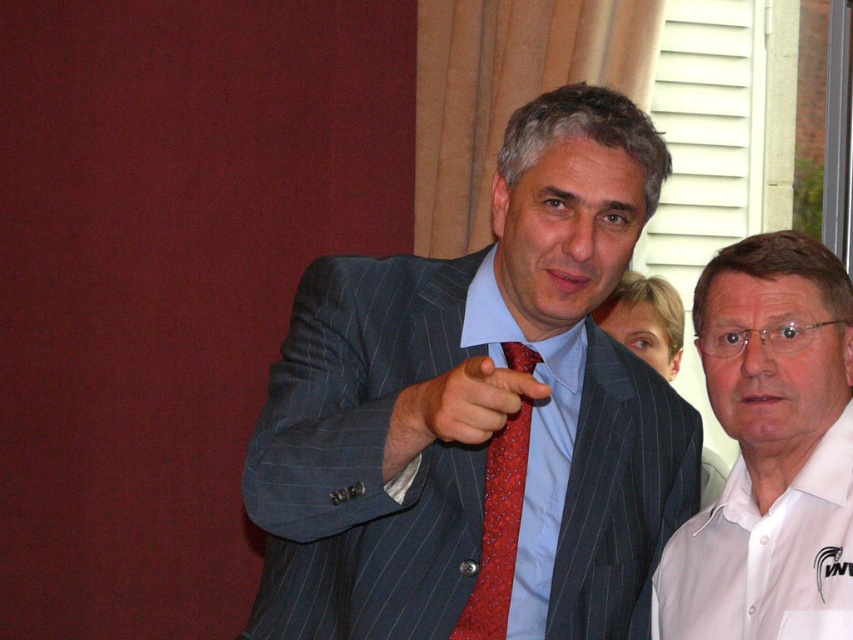
You are a photographer setting up a shoot in a small studio. You have two subjects wearing the pinstriped suit at center and the white cotton polo shirt at lower right. The studio space is narrow, so you need to position them side by side without overlapping. Based on their clothing, which subject should you place closer to the left side to ensure they fit within the space?

The pinstriped suit at center is wider than the white cotton polo shirt at lower right, so you should place the pinstriped suit at center closer to the left side to accommodate its width and prevent overlapping.

You are organizing a charity event and need to decide which clothing item to display first based on their sizes. Given the pinstriped suit at center and the white cotton polo shirt at lower right, which one should you choose to place in the spotlight first?

The pinstriped suit at center has a larger size compared to the white cotton polo shirt at lower right, so you should choose the pinstriped suit at center to place in the spotlight first because it is bigger and will catch more attention.